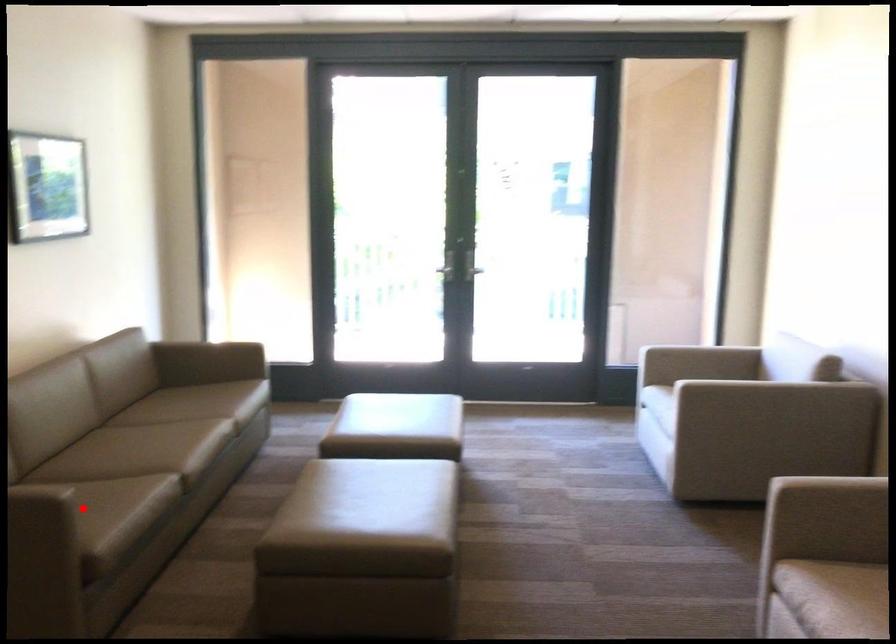
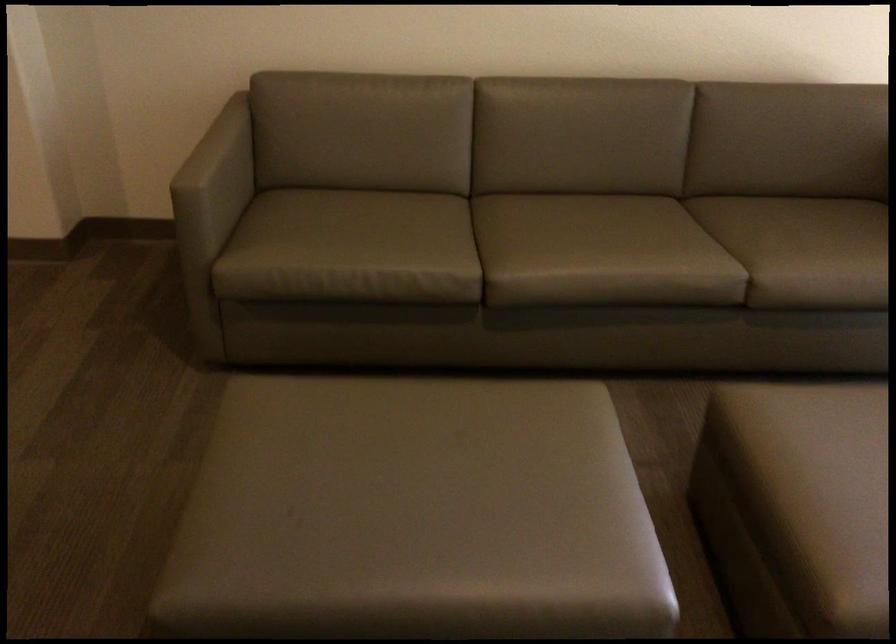
Locate, in the second image, the point that corresponds to the highlighted location in the first image.

(346, 242)